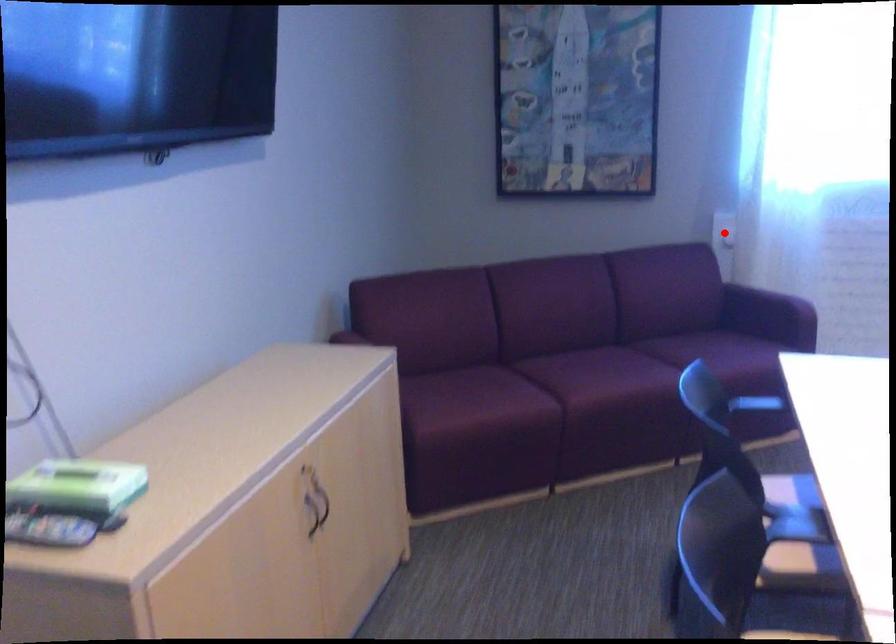
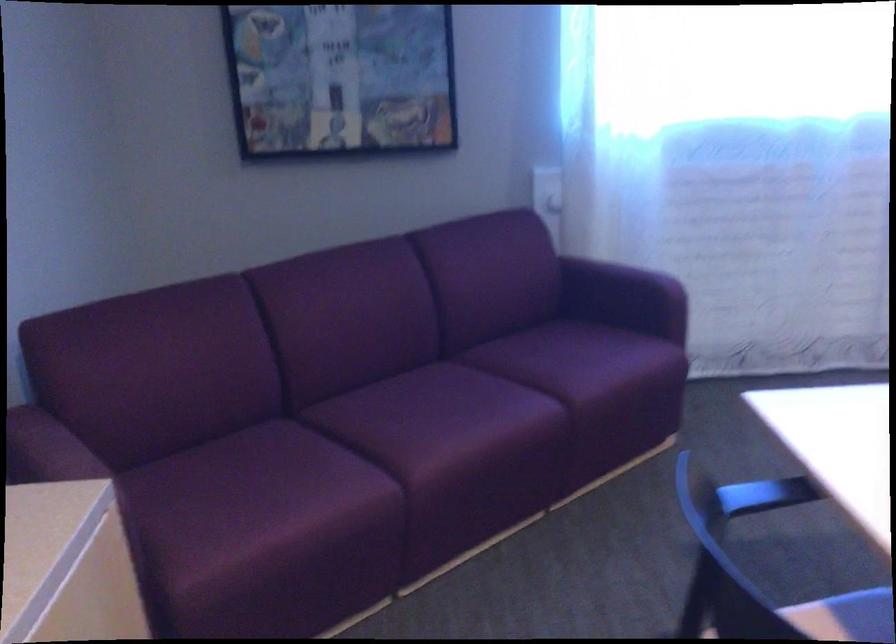
Question: I am providing you with two images of the same scene from different viewpoints. A red point is shown in image1. For the corresponding object point in image2, is it positioned nearer or farther from the camera?

Choices:
 (A) Nearer
 (B) Farther

Answer: (A)